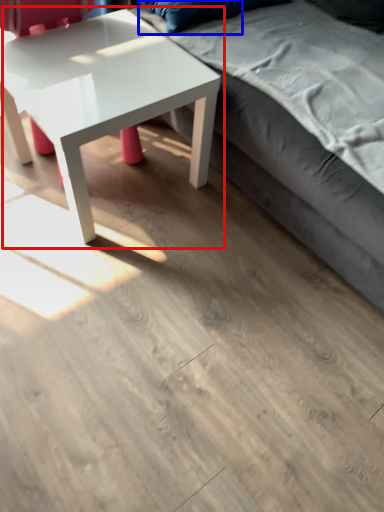
Question: Which object is further to the camera taking this photo, coffee table (highlighted by a red box) or pillow (highlighted by a blue box)?

Choices:
 (A) coffee table
 (B) pillow

Answer: (B)